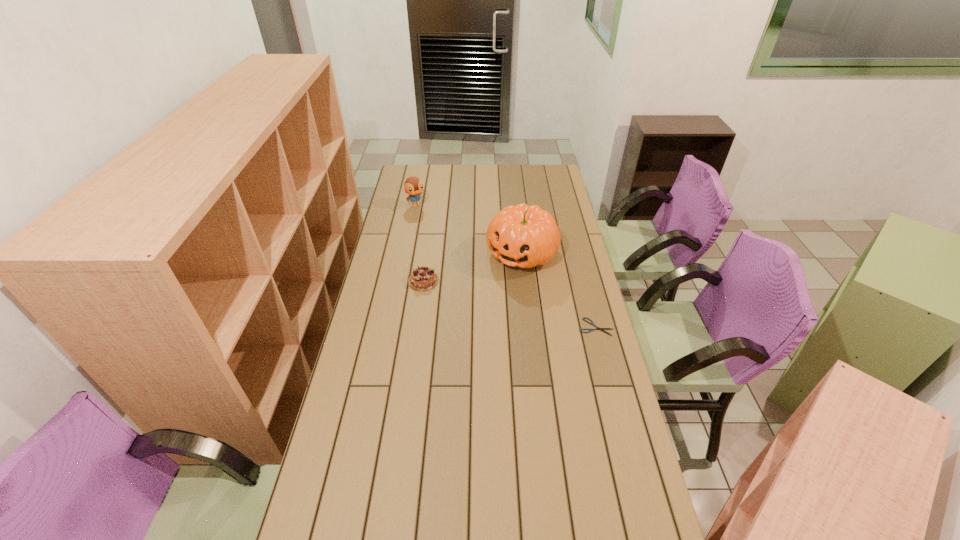
Where is `free location that satisfies the following two spatial constraints: 1. on the back side of the pumpkin; 2. on the right side of the chocolate cake`? This screenshot has width=960, height=540. free location that satisfies the following two spatial constraints: 1. on the back side of the pumpkin; 2. on the right side of the chocolate cake is located at coordinates 427,253.